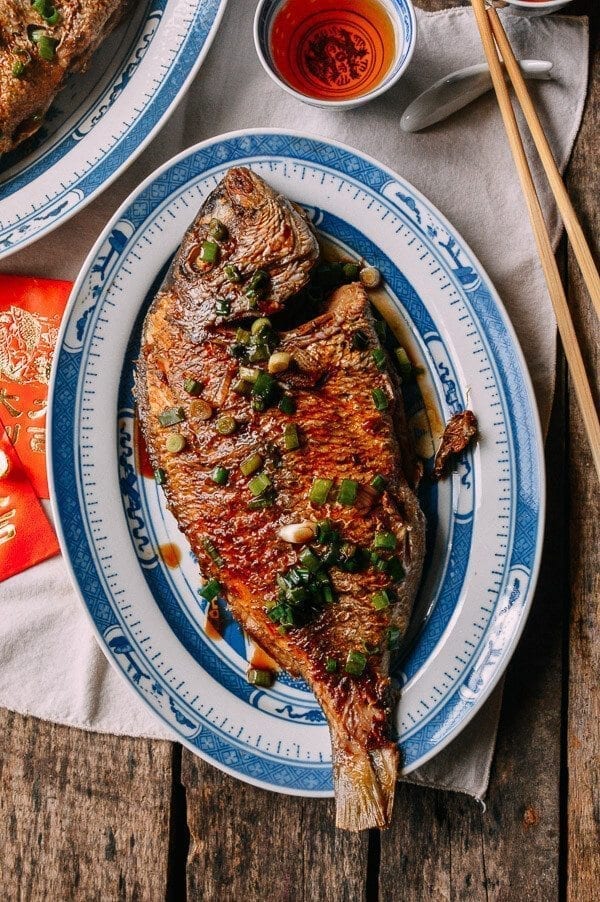
Where is `wood table`? The width and height of the screenshot is (600, 902). wood table is located at coordinates (511, 825).